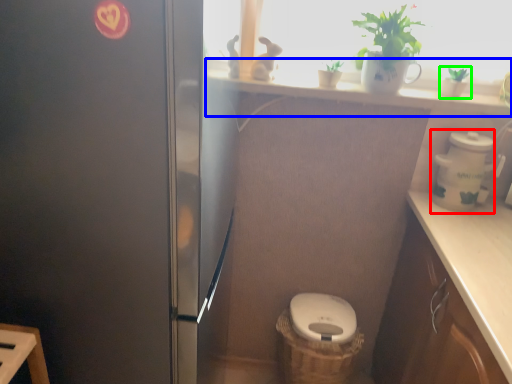
Question: Considering the real-world distances, which object is farthest from appliance (highlighted by a red box)? window sill (highlighted by a blue box) or houseplant (highlighted by a green box)?

Choices:
 (A) window sill
 (B) houseplant

Answer: (A)